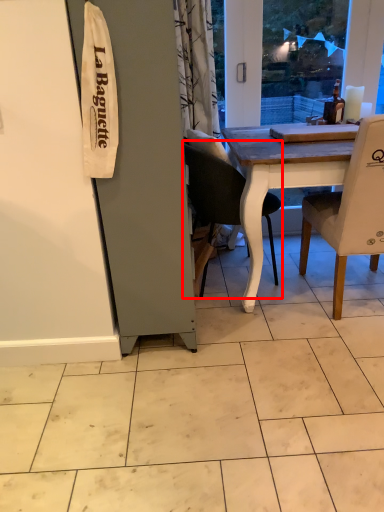
Question: In this image, where is chair (annotated by the red box) located relative to chair?

Choices:
 (A) left
 (B) right

Answer: (A)